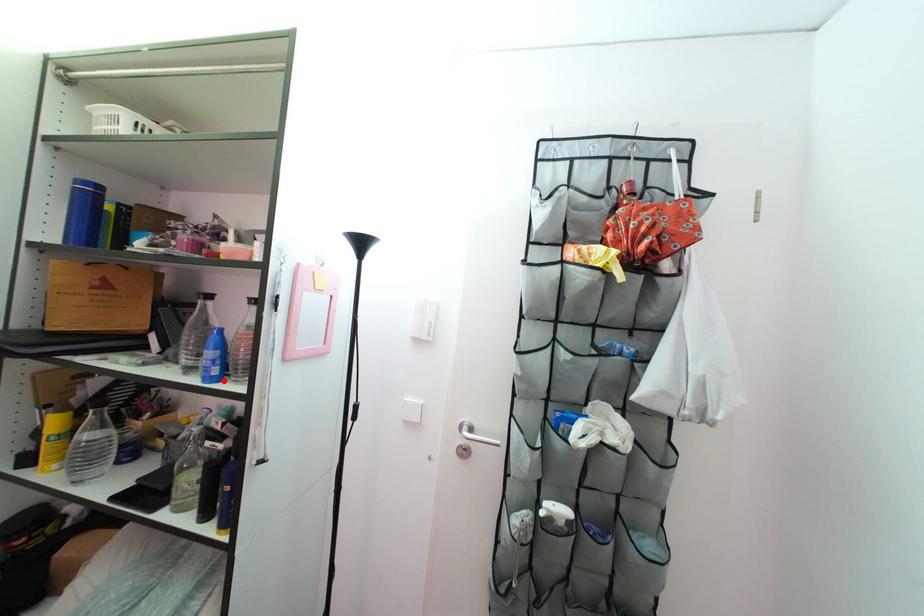
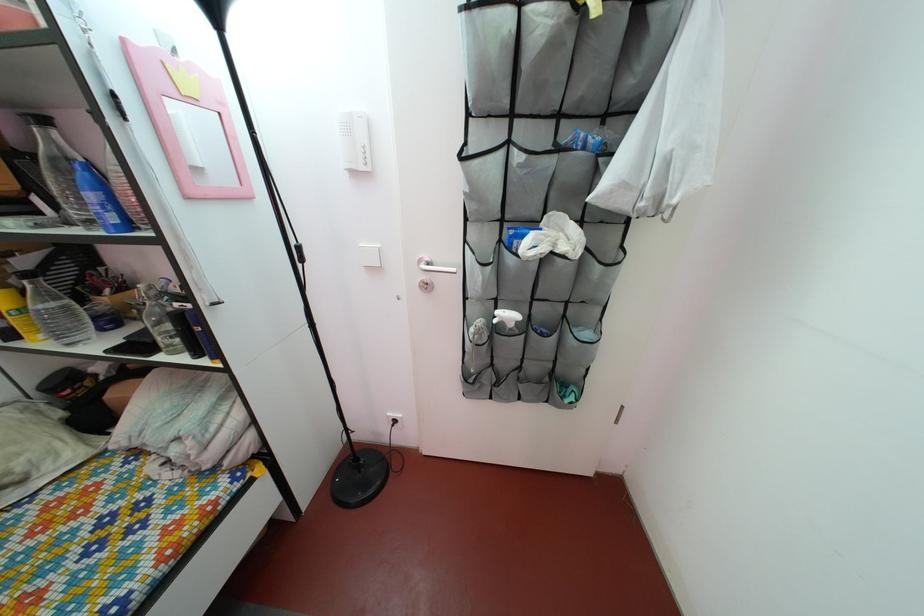
Where in the second image is the point corresponding to the highlighted location from the first image?

(124, 229)